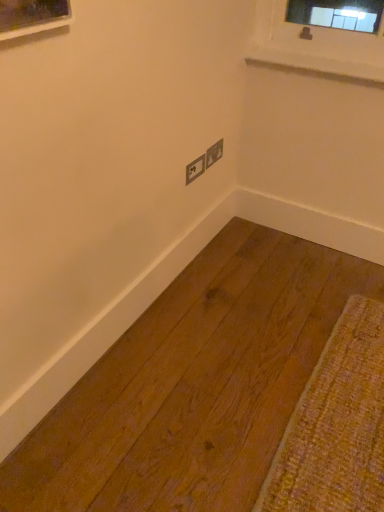
Where is `vacant space situated above white smooth window sill at upper right (from a real-world perspective)`? This screenshot has height=512, width=384. vacant space situated above white smooth window sill at upper right (from a real-world perspective) is located at coordinates (320, 52).